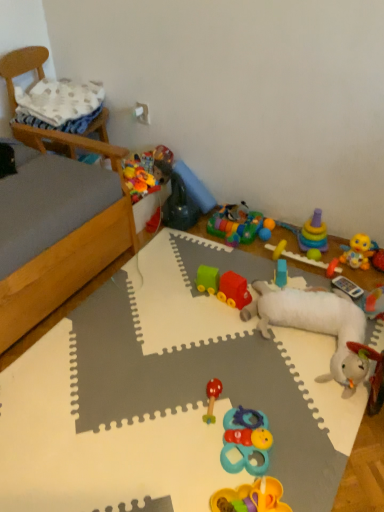
Locate an element on the screen. empty space that is in between blue rubber teething ring at center, positioned as the first toy in bottom-to-top order, and blue plastic toy at center, which is counted as the sixth toy, starting from the top is located at coordinates [x=265, y=368].